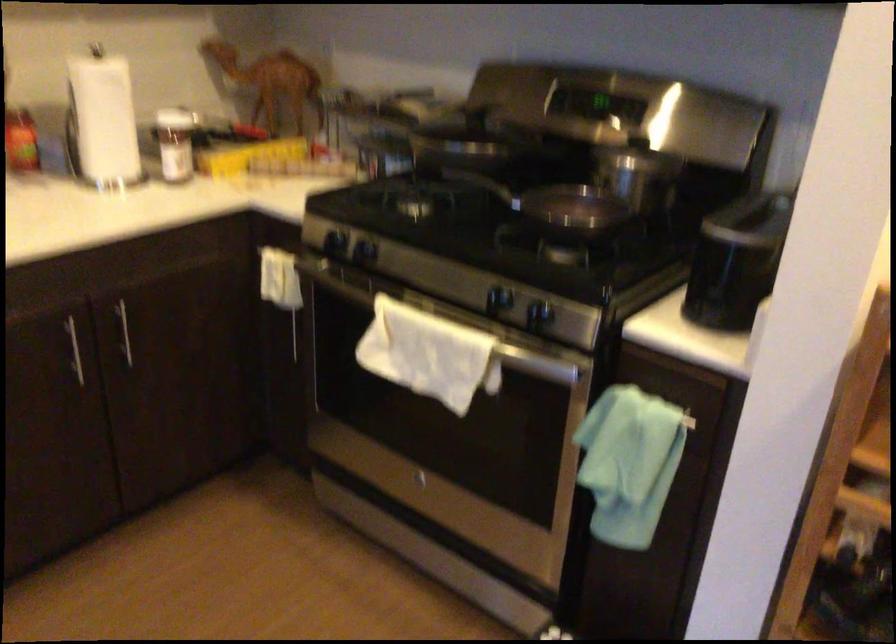
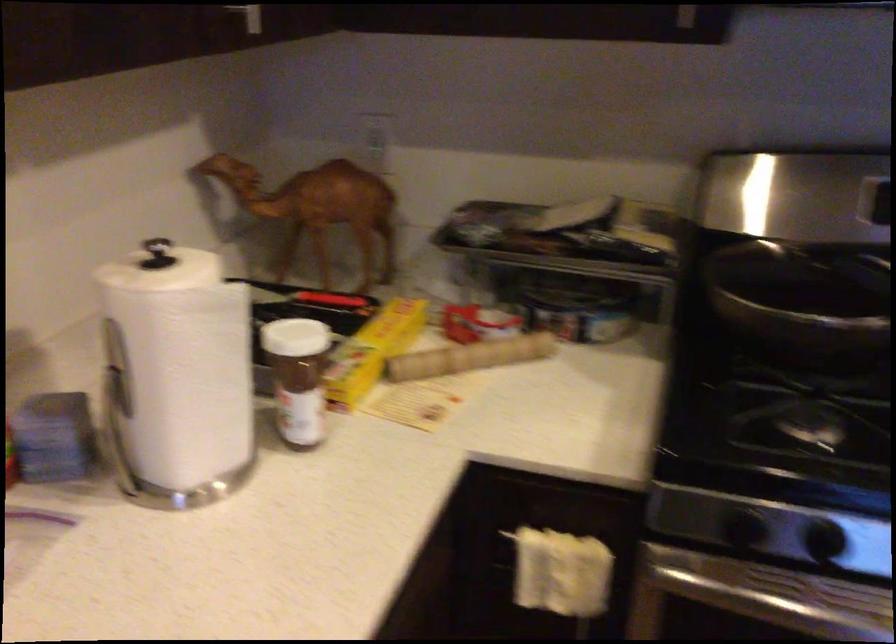
Locate, in the second image, the point that corresponds to pixel 164 109 in the first image.

(289, 337)